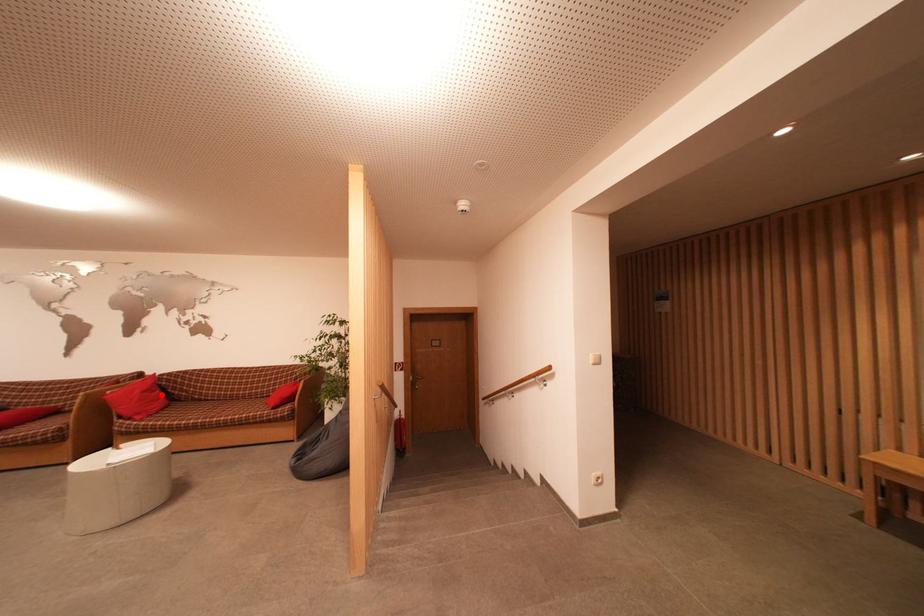
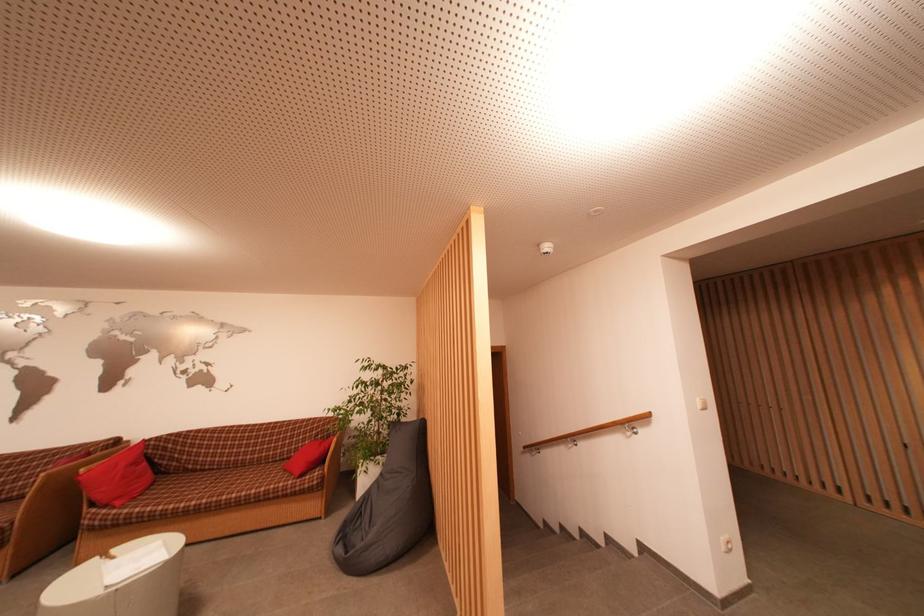
In the second image, find the point that corresponds to the highlighted location in the first image.

(149, 467)